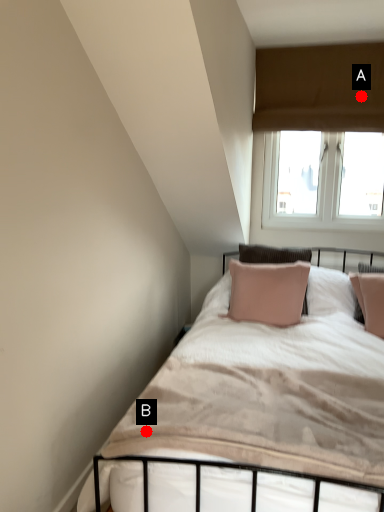
Question: Two points are circled on the image, labeled by A and B beside each circle. Which point is closer to the camera?

Choices:
 (A) A is closer
 (B) B is closer

Answer: (B)